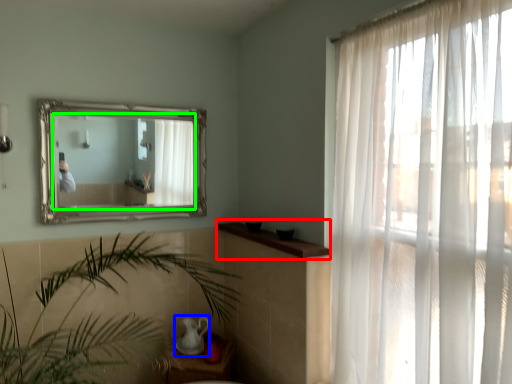
Question: Which object is the farthest from window sill (highlighted by a red box)? Choose among these: tea pot (highlighted by a blue box) or mirror (highlighted by a green box).

Choices:
 (A) tea pot
 (B) mirror

Answer: (B)